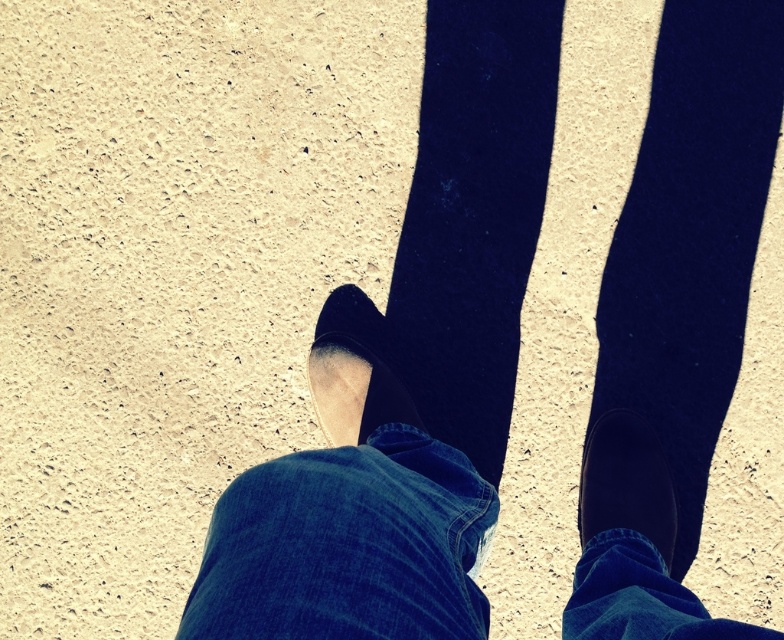
Does denim at center appear under black suede shoe at lower right?

Yes, denim at center is below black suede shoe at lower right.

Does point (394, 472) come behind point (628, 499)?

No, it is in front of (628, 499).

Which is behind, point (396, 534) or point (645, 492)?

The point (645, 492) is more distant.

Find the location of a particular element. The height and width of the screenshot is (640, 784). denim at center is located at coordinates (347, 547).

Between point (329, 422) and point (605, 483), which one is positioned in front?

Point (605, 483) is in front.

Measure the distance between suede black shoe at center and black suede shoe at lower right.

suede black shoe at center is 12.49 inches from black suede shoe at lower right.

Between point (340, 404) and point (648, 534), which one is positioned behind?

Point (340, 404)

Locate an element on the screen. The image size is (784, 640). suede black shoe at center is located at coordinates (354, 371).

Does denim at center appear under suede black shoe at center?

Yes.

Who is shorter, denim at center or suede black shoe at center?

Standing shorter between the two is suede black shoe at center.

Does point (454, 547) come in front of point (350, 288)?

Yes, it is in front of point (350, 288).

The image size is (784, 640). I want to click on denim at center, so click(x=347, y=547).